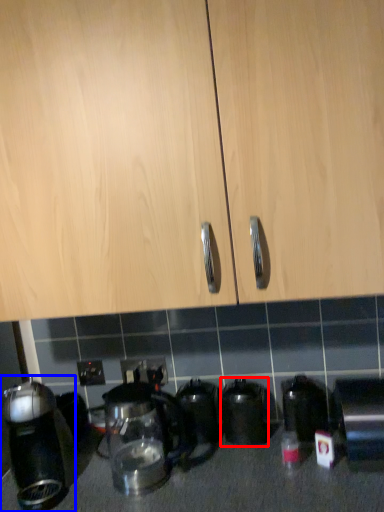
Question: Among these objects, which one is nearest to the camera, kitchen appliance (highlighted by a red box) or kitchen appliance (highlighted by a blue box)?

Choices:
 (A) kitchen appliance
 (B) kitchen appliance

Answer: (B)